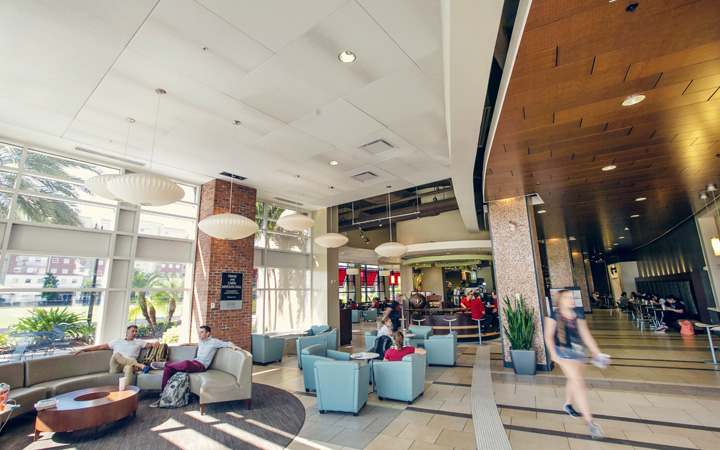
Locate an element on the screen. Image resolution: width=720 pixels, height=450 pixels. ceiling lights is located at coordinates (348, 56), (333, 164).